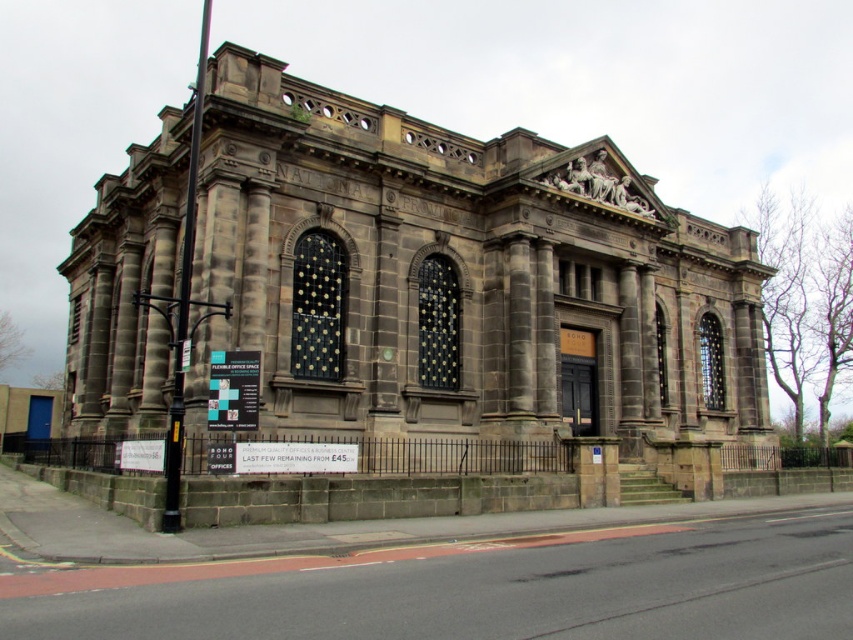
You are a visitor approaching the dark gray stone church at center and notice the white plastic sign at lower left. Which object is wider from your perspective?

The dark gray stone church at center is wider than the white plastic sign at lower left according to the description.

You are standing in front of the dark gray stone church at center and want to place a new white plastic sign at lower left. Considering the height difference between the two, will the sign be visible from the street level?

The dark gray stone church at center is taller than the white plastic sign at lower left, so the sign may be obscured by the church if placed directly in front of it. Positioning the sign to the side or further away from the church could ensure visibility from the street level.